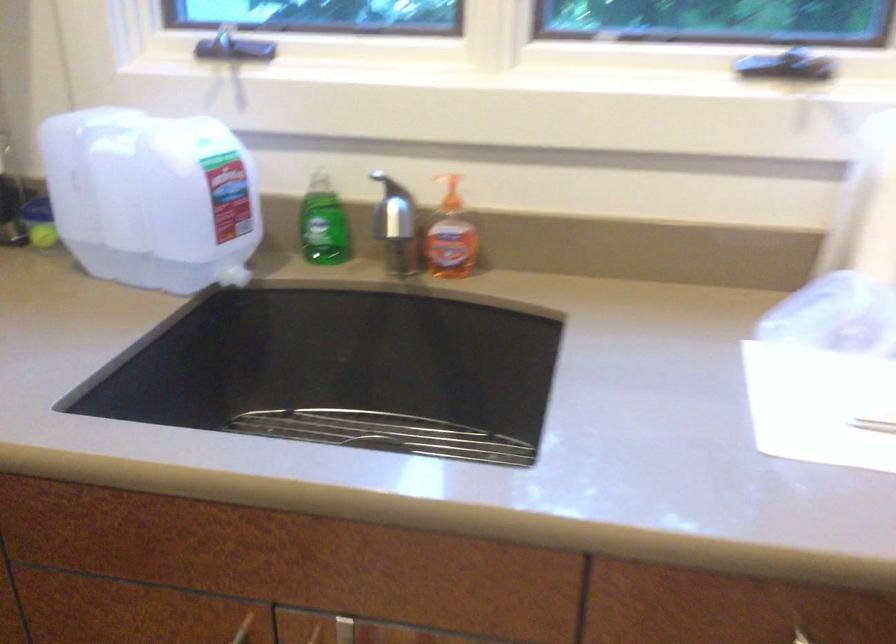
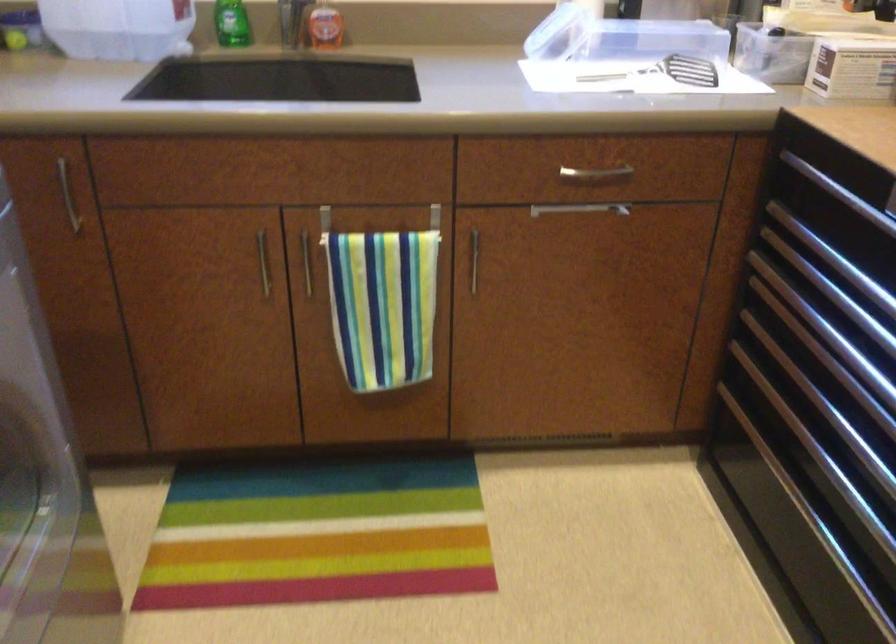
Question: The camera is either moving clockwise (left) or counter-clockwise (right) around the object. The first image is from the beginning of the video and the second image is from the end. Is the camera moving left or right when shooting the video?

Choices:
 (A) Left
 (B) Right

Answer: (A)